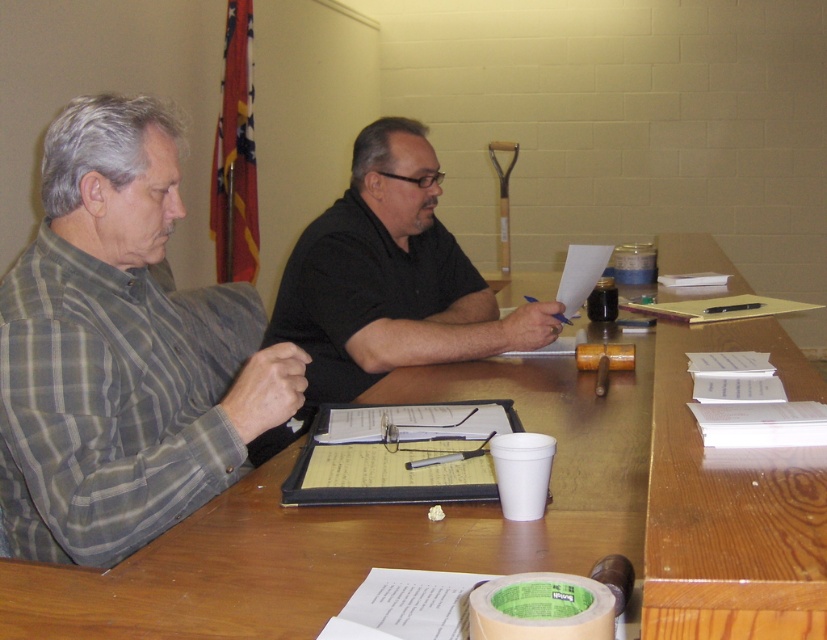
Question: Does wooden table at center have a larger size compared to black matte shirt at center?

Choices:
 (A) yes
 (B) no

Answer: (A)

Question: Can you confirm if plaid cotton shirt at left is bigger than black matte shirt at center?

Choices:
 (A) no
 (B) yes

Answer: (B)

Question: Which object appears closest to the camera in this image?

Choices:
 (A) plaid cotton shirt at left
 (B) white paper at center
 (C) wooden table at center
 (D) black matte shirt at center

Answer: (C)

Question: Is plaid cotton shirt at left to the left of white paper at center from the viewer's perspective?

Choices:
 (A) yes
 (B) no

Answer: (A)

Question: Which point is farther to the camera?

Choices:
 (A) white paper at center
 (B) plaid cotton shirt at left

Answer: (A)

Question: Which object appears closest to the camera in this image?

Choices:
 (A) white paper at center
 (B) black matte shirt at center
 (C) wooden table at center
 (D) plaid cotton shirt at left

Answer: (C)